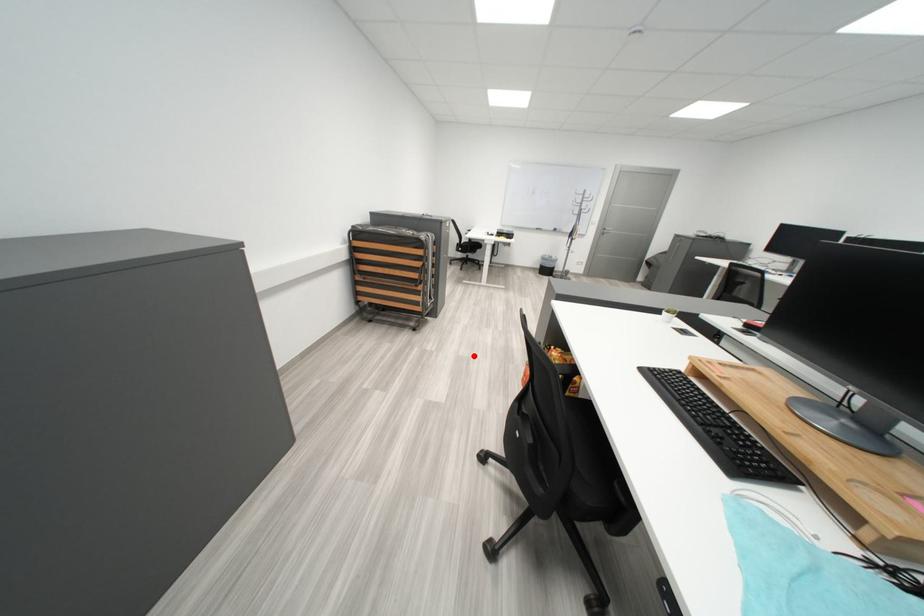
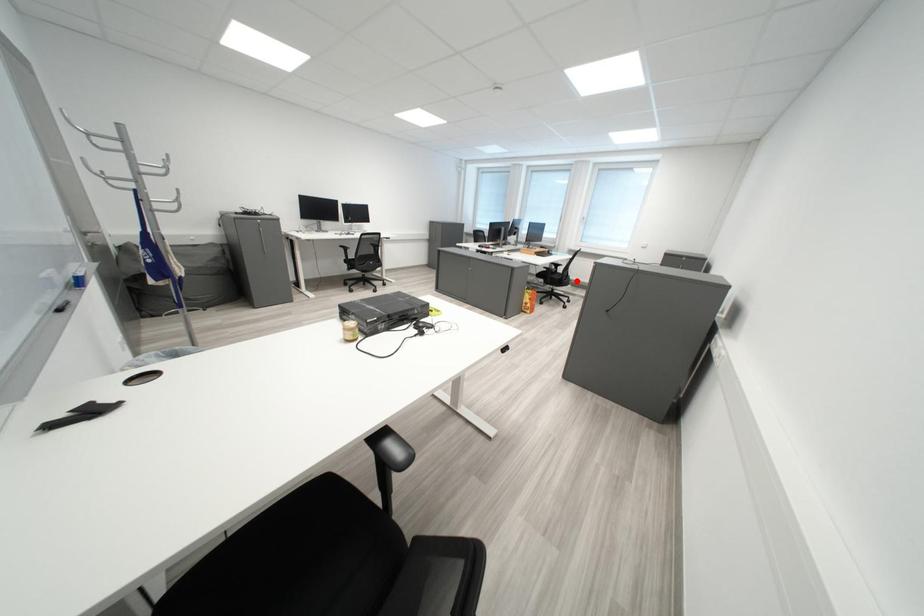
I am providing you with two images of the same scene from different viewpoints. A red point is marked on the first image and another point is marked on the second image. Does the point marked in image1 correspond to the same location as the one in image2?

No